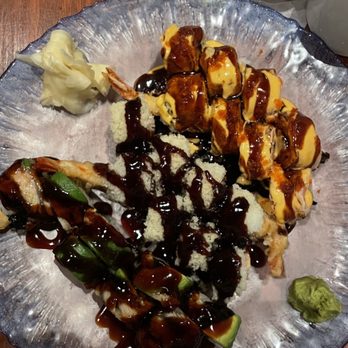
Where is `silver plate for eating on`? The width and height of the screenshot is (348, 348). silver plate for eating on is located at coordinates (23, 323).